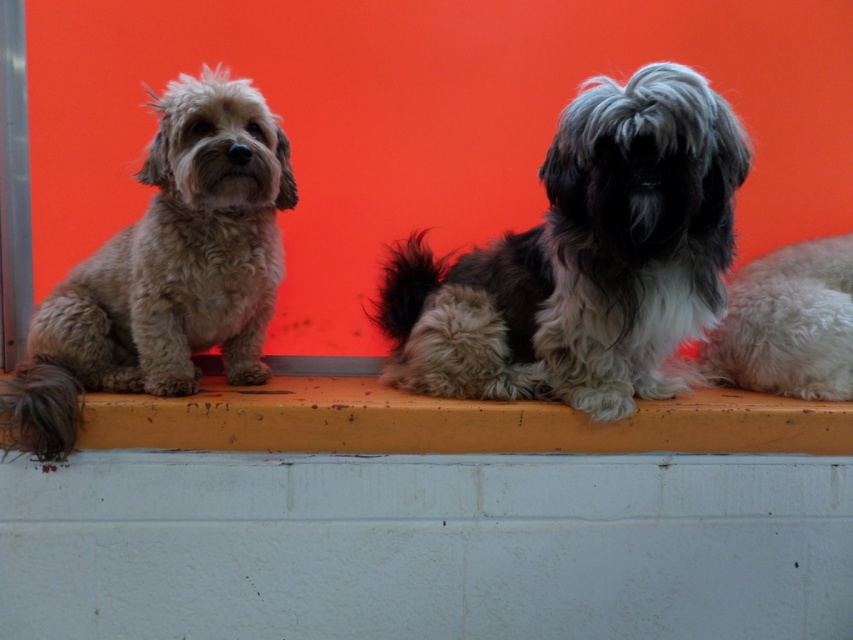
You are a photographer trying to capture both the fluffy white dog at center and the yellow painted wood at center in a single frame. Since you want both subjects to be clearly visible, which one should you focus on first to ensure the larger subject is in sharp focus?

The fluffy white dog at center has a larger size compared to the yellow painted wood at center, so you should focus on the fluffy white dog at center first to ensure it is in sharp focus.

You are a photographer setting up a tripod to take a portrait of the light brown fur at left and the white fluffy dog at center. Based on their heights, which dog should you adjust the tripod height to focus on first?

The light brown fur at left is taller than the white fluffy dog at center, so you should adjust the tripod height to focus on the light brown fur at left first to ensure proper framing.

You are a photographer trying to capture both the light brown fur at left and the yellow painted wood at center in a single frame. Which object should you focus on first to ensure both are in the shot?

The light brown fur at left is bigger than the yellow painted wood at center, so you should focus on the light brown fur at left first to ensure both are in the shot.